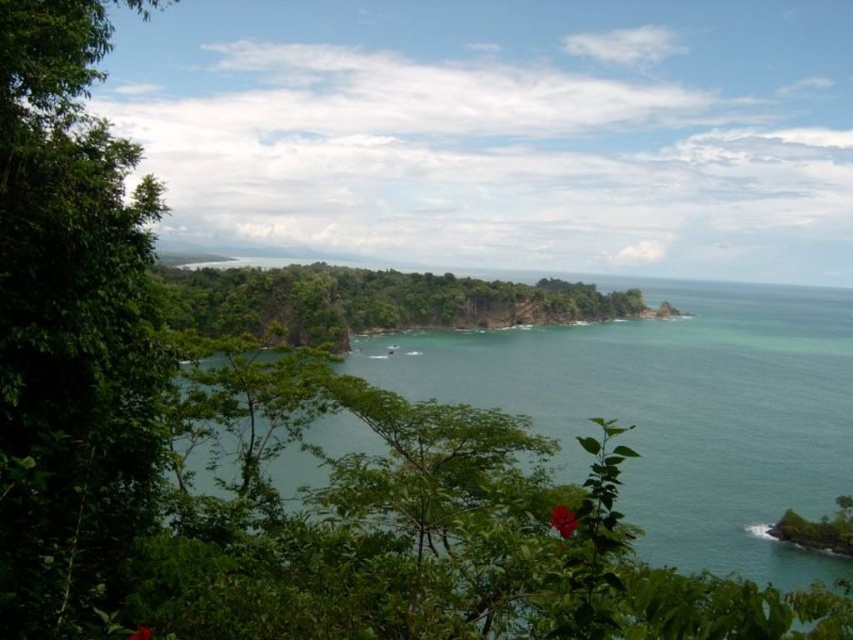
Is green leafy tree at left bigger than green glossy water at center?

No.

Locate an element on the screen. green leafy tree at left is located at coordinates (68, 320).

Can you confirm if green leafy tree at left is smaller than green leafy forest at center?

Yes.

Is green leafy tree at left wider than green leafy forest at center?

No.

Where is `green leafy tree at left`? The height and width of the screenshot is (640, 853). green leafy tree at left is located at coordinates (68, 320).

The width and height of the screenshot is (853, 640). Identify the location of green leafy tree at left. (68, 320).

Is point (741, 468) farther from camera compared to point (283, 317)?

No, it is in front of (283, 317).

Can you confirm if green glossy water at center is thinner than green leafy forest at center?

In fact, green glossy water at center might be wider than green leafy forest at center.

Measure the distance between point (434,376) and camera.

Point (434,376) and camera are 102.24 meters apart from each other.

At what (x,y) coordinates should I click in order to perform the action: click on green glossy water at center. Please return your answer as a coordinate pair (x, y). The width and height of the screenshot is (853, 640). Looking at the image, I should click on (676, 408).